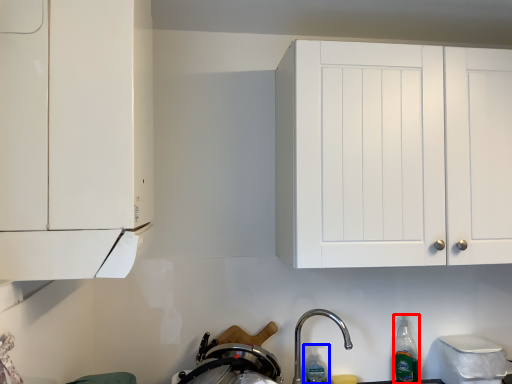
Question: Which of the following is the farthest to the observer, bottle (highlighted by a red box) or bottle (highlighted by a blue box)?

Choices:
 (A) bottle
 (B) bottle

Answer: (A)